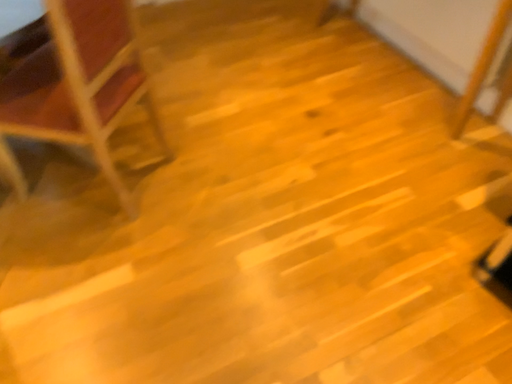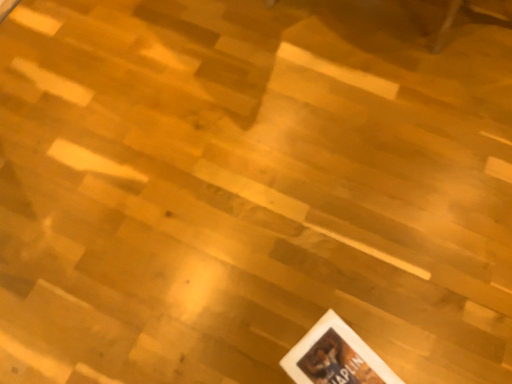
Question: Which way did the camera rotate in the video?

Choices:
 (A) rotated right
 (B) rotated left

Answer: (B)